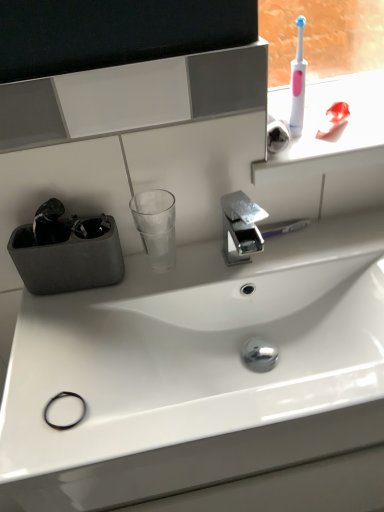
Question: Is transparent glass at center completely or partially outside of pink plastic toothbrush at upper right?

Choices:
 (A) yes
 (B) no

Answer: (A)

Question: Does transparent glass at center have a greater width compared to pink plastic toothbrush at upper right?

Choices:
 (A) no
 (B) yes

Answer: (A)

Question: Can you confirm if transparent glass at center is taller than pink plastic toothbrush at upper right?

Choices:
 (A) no
 (B) yes

Answer: (B)

Question: Is pink plastic toothbrush at upper right completely or partially inside transparent glass at center?

Choices:
 (A) yes
 (B) no

Answer: (B)

Question: Is transparent glass at center smaller than pink plastic toothbrush at upper right?

Choices:
 (A) no
 (B) yes

Answer: (B)

Question: Is pink plastic toothbrush at upper right inside the boundaries of polished chrome tap at center, or outside?

Choices:
 (A) inside
 (B) outside

Answer: (B)

Question: Based on their positions, is pink plastic toothbrush at upper right located to the left or right of polished chrome tap at center?

Choices:
 (A) right
 (B) left

Answer: (A)

Question: From a real-world perspective, relative to polished chrome tap at center, is pink plastic toothbrush at upper right vertically above or below?

Choices:
 (A) above
 (B) below

Answer: (A)

Question: Relative to polished chrome tap at center, is pink plastic toothbrush at upper right in front or behind?

Choices:
 (A) front
 (B) behind

Answer: (B)

Question: Considering the positions of transparent glass at center and polished chrome tap at center in the image, is transparent glass at center taller or shorter than polished chrome tap at center?

Choices:
 (A) short
 (B) tall

Answer: (B)

Question: Is transparent glass at center in front of or behind polished chrome tap at center in the image?

Choices:
 (A) behind
 (B) front

Answer: (A)

Question: Considering the positions of transparent glass at center and polished chrome tap at center in the image, is transparent glass at center bigger or smaller than polished chrome tap at center?

Choices:
 (A) small
 (B) big

Answer: (A)

Question: From the image's perspective, is transparent glass at center positioned above or below polished chrome tap at center?

Choices:
 (A) below
 (B) above

Answer: (B)

Question: Is pink plastic toothbrush at upper right taller or shorter than white plastic toothbrush at upper right?

Choices:
 (A) short
 (B) tall

Answer: (A)

Question: Is pink plastic toothbrush at upper right inside the boundaries of white plastic toothbrush at upper right, or outside?

Choices:
 (A) outside
 (B) inside

Answer: (A)